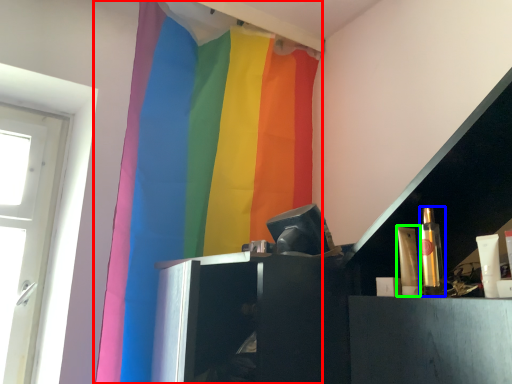
Question: Which object is the closest to the curtain (highlighted by a red box)? Choose among these: toiletry (highlighted by a blue box) or toiletry (highlighted by a green box).

Choices:
 (A) toiletry
 (B) toiletry

Answer: (B)